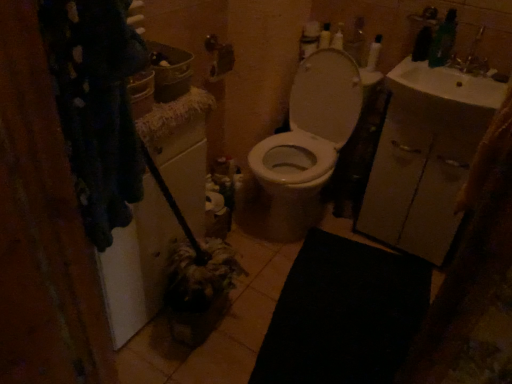
Question: Is point (347, 119) positioned closer to the camera than point (459, 97)?

Choices:
 (A) farther
 (B) closer

Answer: (A)

Question: Is white glossy toilet at center to the left or to the right of white glossy sink at upper right in the image?

Choices:
 (A) left
 (B) right

Answer: (A)

Question: Which is nearer to the white glossy sink at upper right?

Choices:
 (A) white glossy toilet at center
 (B) white glossy bottle at upper right

Answer: (B)

Question: Estimate the real-world distances between objects in this image. Which object is farther from the white glossy bottle at upper right?

Choices:
 (A) white glossy sink at upper right
 (B) white glossy toilet at center

Answer: (B)